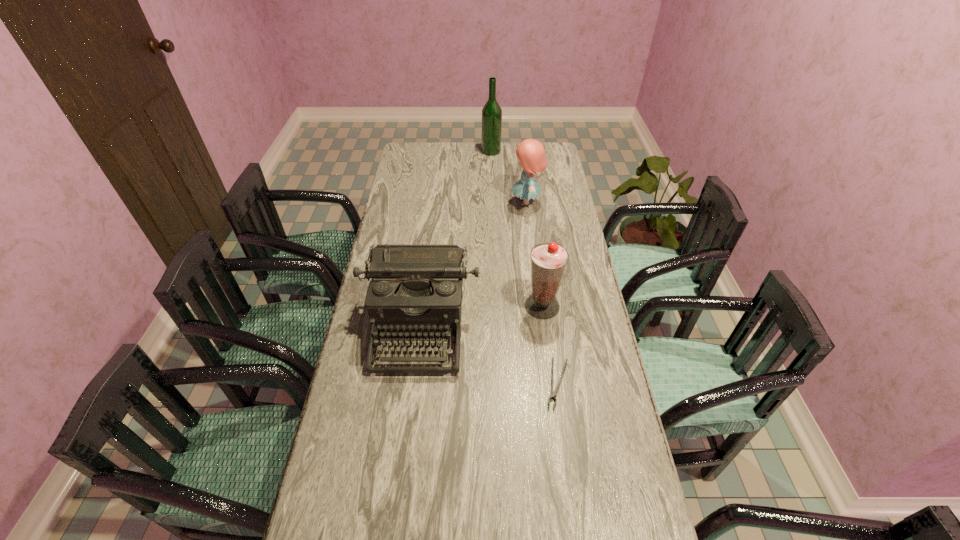
Where is `the second object from left to right`? This screenshot has width=960, height=540. the second object from left to right is located at coordinates click(491, 113).

Where is `the tallest object`? the tallest object is located at coordinates (491, 113).

Identify the location of the second farthest object. This screenshot has width=960, height=540. (531, 153).

Where is `smoothie`? smoothie is located at coordinates (548, 261).

The image size is (960, 540). What are the coordinates of `the leftmost object` in the screenshot? It's located at (416, 288).

Where is `the fourth tallest object`? This screenshot has height=540, width=960. the fourth tallest object is located at coordinates (416, 288).

Locate an element on the screen. the shortest object is located at coordinates (553, 393).

Identify the location of vacant point located 0.210m on the right of the alcohol. (541, 151).

You are a GUI agent. You are given a task and a screenshot of the screen. Output one action in this format:
    pyautogui.click(x=<x>, y=<y>)
    Task: Click on the free space located on the front-facing side of the doll
    This screenshot has height=540, width=960.
    Given the screenshot: What is the action you would take?
    pyautogui.click(x=467, y=203)

I want to click on vacant area located on the front-facing side of the doll, so click(x=434, y=203).